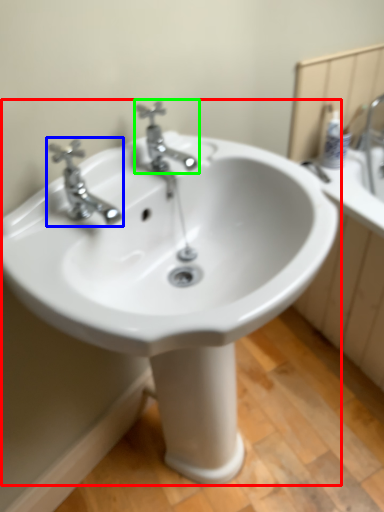
Question: Which is nearer to the sink (highlighted by a red box)? tap (highlighted by a blue box) or tap (highlighted by a green box).

Choices:
 (A) tap
 (B) tap

Answer: (A)